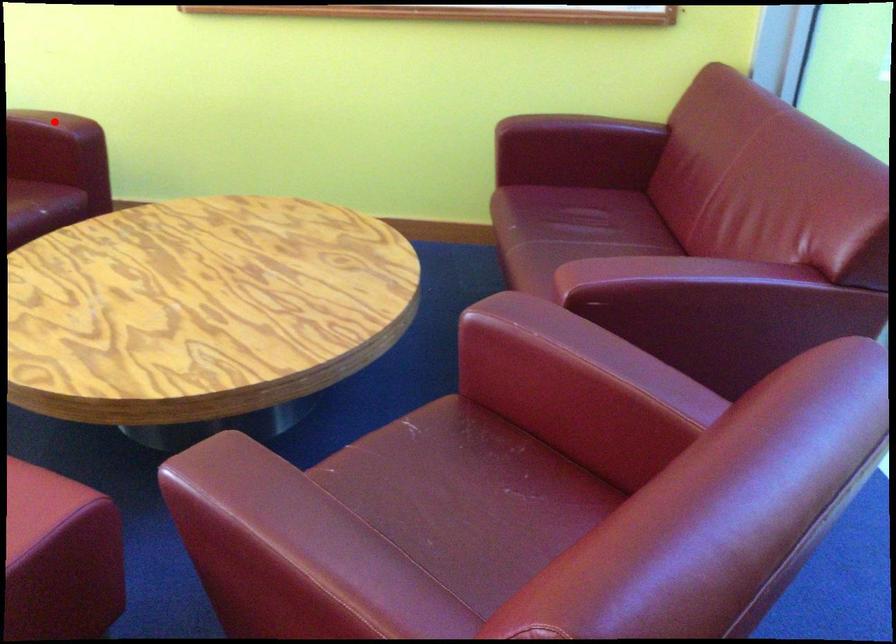
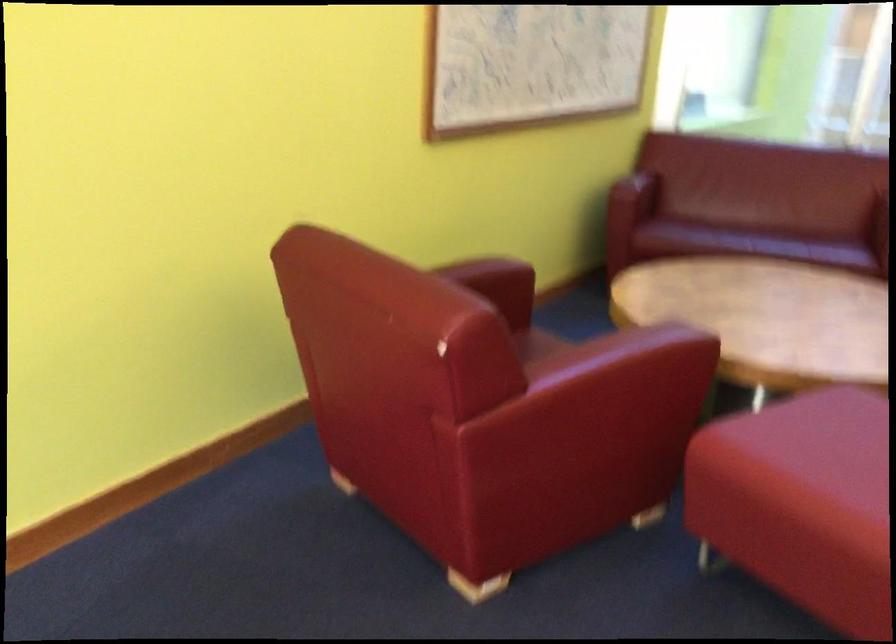
Question: I am providing you with two images of the same scene from different viewpoints. A red point is marked on the first image. Can you still see the location of the red point in image 2?

Choices:
 (A) Yes
 (B) No

Answer: (B)